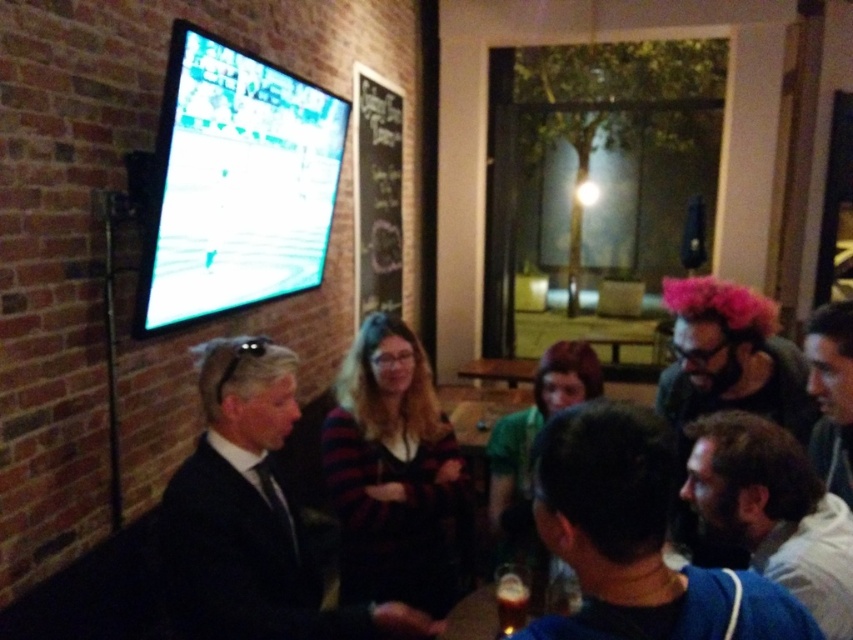
Which is above, dark blue t-shirt at center or smooth black hair at lower right?

smooth black hair at lower right is above.

Which of these two, dark blue t-shirt at center or smooth black hair at lower right, stands shorter?

Standing shorter between the two is dark blue t-shirt at center.

Between point (738, 572) and point (814, 346), which one is positioned in front?

Positioned in front is point (738, 572).

Where is `dark blue t-shirt at center`? Image resolution: width=853 pixels, height=640 pixels. dark blue t-shirt at center is located at coordinates (636, 540).

Can you confirm if smooth black hair at lower right is positioned to the right of translucent glass beer at lower center?

Indeed, smooth black hair at lower right is positioned on the right side of translucent glass beer at lower center.

You are a GUI agent. You are given a task and a screenshot of the screen. Output one action in this format:
    pyautogui.click(x=<x>, y=<y>)
    Task: Click on the smooth black hair at lower right
    
    Given the screenshot: What is the action you would take?
    pyautogui.click(x=831, y=394)

In the scene shown: Which of these two, pink fuzzy wig at upper right or smooth black hair at lower right, stands taller?

smooth black hair at lower right is taller.

Between point (694, 305) and point (833, 381), which one is positioned behind?

The point (694, 305) is more distant.

Between point (775, 406) and point (822, 456), which one is positioned behind?

The point (775, 406) is more distant.

Locate an element on the screen. pink fuzzy wig at upper right is located at coordinates (730, 356).